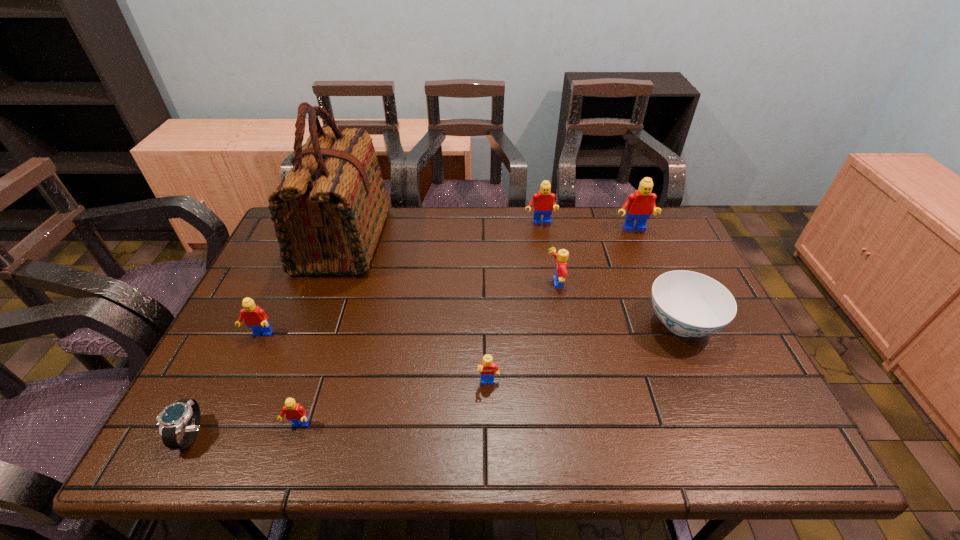
Identify which object is located as the second nearest to the rightmost Lego. Please provide its 2D coordinates. Your answer should be formatted as a tuple, i.e. [(x, y)], where the tuple contains the x and y coordinates of a point satisfying the conditions above.

[(562, 256)]

Locate which object ranks third in proximity to the silver watch. Please provide its 2D coordinates. Your answer should be formatted as a tuple, i.e. [(x, y)], where the tuple contains the x and y coordinates of a point satisfying the conditions above.

[(328, 212)]

Select which Lego appears as the third closest to the rightmost Lego. Please provide its 2D coordinates. Your answer should be formatted as a tuple, i.e. [(x, y)], where the tuple contains the x and y coordinates of a point satisfying the conditions above.

[(487, 368)]

Point out which Lego is positioned as the fifth nearest to the second red Lego from right to left. Please provide its 2D coordinates. Your answer should be formatted as a tuple, i.e. [(x, y)], where the tuple contains the x and y coordinates of a point satisfying the conditions above.

[(296, 413)]

At what (x,y) coordinates should I click in order to perform the action: click on red Lego that is the third closest to the nearest red Lego. Please return your answer as a coordinate pair (x, y). The width and height of the screenshot is (960, 540). Looking at the image, I should click on click(639, 204).

Identify which red Lego is the second nearest to the bigger yellow Lego. Please provide its 2D coordinates. Your answer should be formatted as a tuple, i.e. [(x, y)], where the tuple contains the x and y coordinates of a point satisfying the conditions above.

[(639, 204)]

You are a GUI agent. You are given a task and a screenshot of the screen. Output one action in this format:
    pyautogui.click(x=<x>, y=<y>)
    Task: Click on the vacant space that satisfies the following two spatial constraints: 1. on the front-facing side of the fifth shortest Lego; 2. on the open handle side of the tallest object
    The height and width of the screenshot is (540, 960).
    Given the screenshot: What is the action you would take?
    pyautogui.click(x=542, y=240)

Image resolution: width=960 pixels, height=540 pixels. Find the location of `free spot that satisfies the following two spatial constraints: 1. on the face of the right yellow Lego; 2. on the front-facing side of the leftmost Lego`. free spot that satisfies the following two spatial constraints: 1. on the face of the right yellow Lego; 2. on the front-facing side of the leftmost Lego is located at coordinates (564, 335).

Identify the location of free location that satisfies the following two spatial constraints: 1. on the open handle side of the tallest object; 2. on the left side of the blue chinaware. (313, 324).

You are a GUI agent. You are given a task and a screenshot of the screen. Output one action in this format:
    pyautogui.click(x=<x>, y=<y>)
    Task: Click on the free spot that satisfies the following two spatial constraints: 1. on the front-facing side of the chinaware; 2. on the right side of the second tallest Lego
    The height and width of the screenshot is (540, 960).
    Given the screenshot: What is the action you would take?
    pyautogui.click(x=557, y=324)